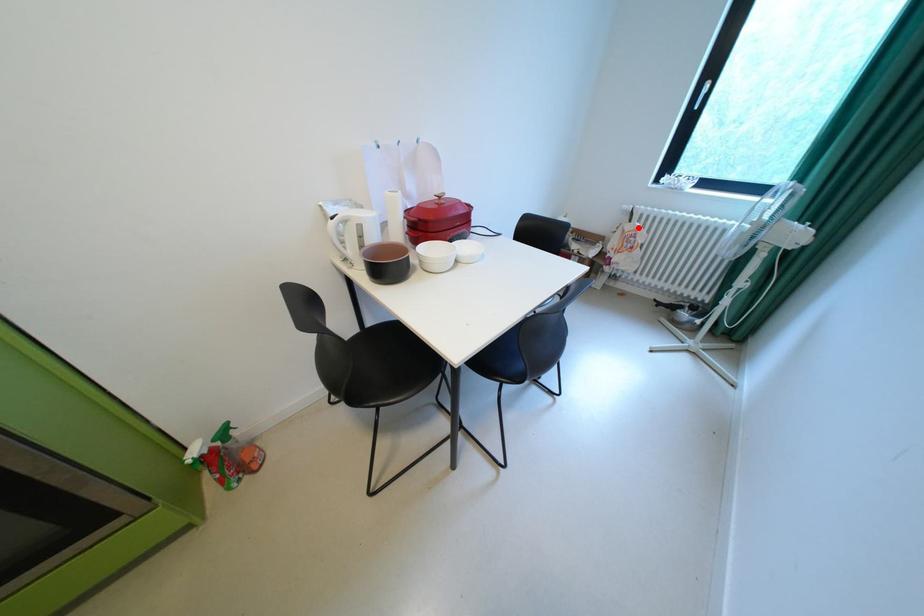
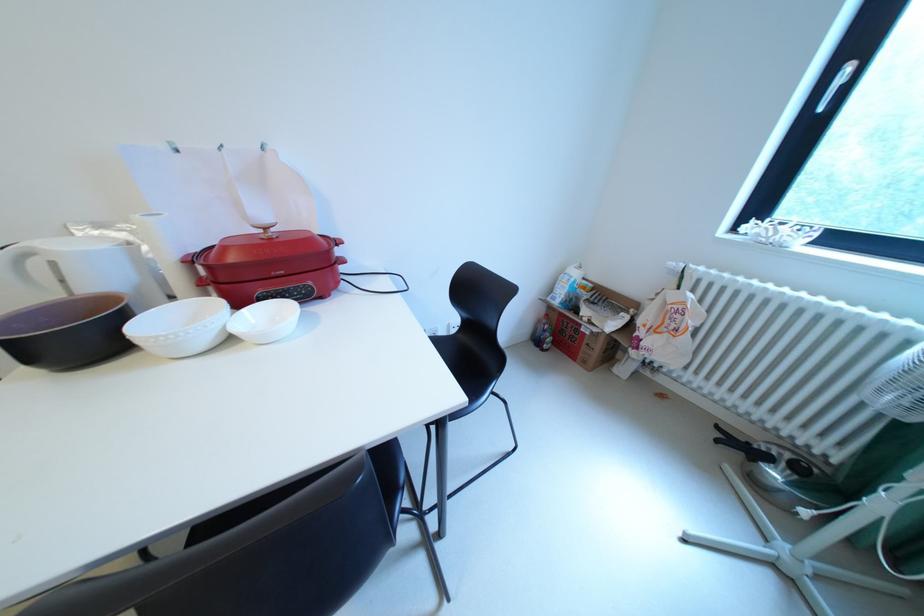
Where in the second image is the point corresponding to the highlighted location from the first image?

(682, 297)